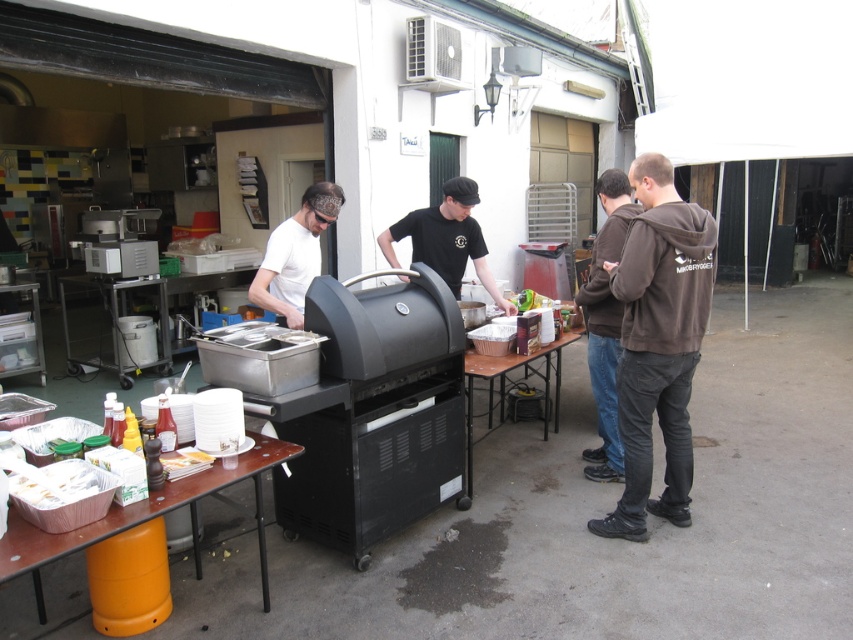
You are standing in the outdoor cooking area and want to grab a plate from the brown wood table at lower left and some condiments from the wooden table at center. Which table should you approach first based on their positions?

You should approach the brown wood table at lower left first because it is closer to you than the wooden table at center.